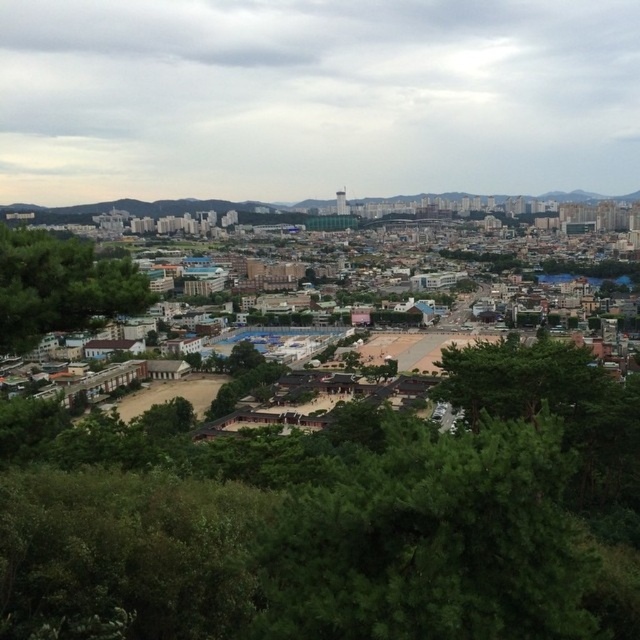
Who is taller, green leafy tree at center or green leafy tree at lower left?

With more height is green leafy tree at lower left.

Between point (468, 348) and point (70, 324), which one is positioned in front?

Point (70, 324)

Identify the location of green leafy tree at center. (556, 406).

In order to click on green leafy tree at center in this screenshot , I will do `click(556, 406)`.